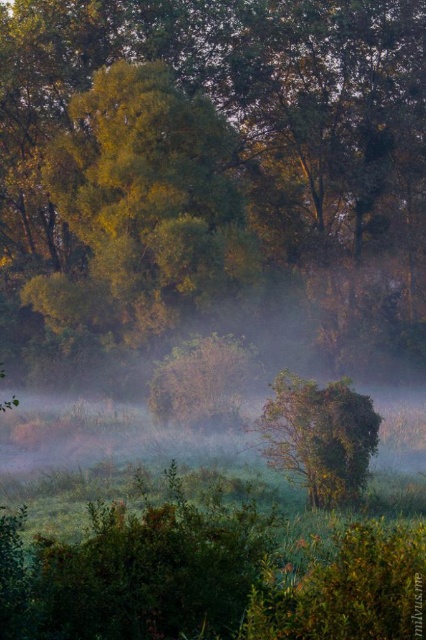
Consider the image. You are standing in the misty landscape and want to walk towards the green leafy tree at upper center and the green leafy tree at upper left. Which tree should you head towards if you want to reach the one that is positioned to the right of the other?

You should head towards the green leafy tree at upper center because it is positioned to the right of the green leafy tree at upper left.

You are standing in the misty landscape and want to walk from the green leafy tree at upper center to the green leafy tree at center. Which direction should you move?

You should move to the right because the green leafy tree at upper center is positioned on the left side of the green leafy tree at center.

You are an environmental scientist assessing the biodiversity of this landscape. You notice the green leafy tree at upper left and the green leafy tree at center. Which tree would you expect to have a larger canopy area based on their height?

The green leafy tree at upper left has a greater height compared to the green leafy tree at center, so it likely has a larger canopy area.